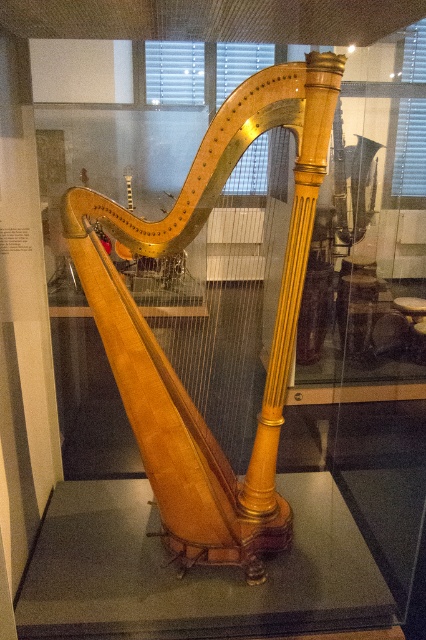
You are a museum visitor who wants to take a photo of the wooden harp at center without any reflections from the transparent glass table at center. Where should you position yourself relative to the glass display to avoid reflections?

The wooden harp at center is much taller than the transparent glass table at center, so positioning yourself above the glass display would allow you to capture the harp without reflections from the table below.

You are a museum visitor holding a small camera. You want to take a photo of the wooden harp at center without it being blocked by the transparent glass table at center. Is the harp narrow enough to fit within the table?

The wooden harp at center is narrower than the transparent glass table at center. Therefore, the wooden harp at center can fit within the transparent glass table at center without being blocked.

You are a museum visitor who wants to take a photo of the wooden harp at center without any reflections from the transparent glass table at center. Since the glass table is part of the display case, you can only move around the exhibit to find an angle where the glass table is not in the frame. Based on their sizes, which object should you position closer to the edge of your camera viewfinder to achieve this?

Since the wooden harp at center is larger in size than the transparent glass table at center, you should position the transparent glass table at center closer to the edge of your camera viewfinder. This way, the smaller glass table will be easier to exclude from the frame while keeping the larger harp centered.